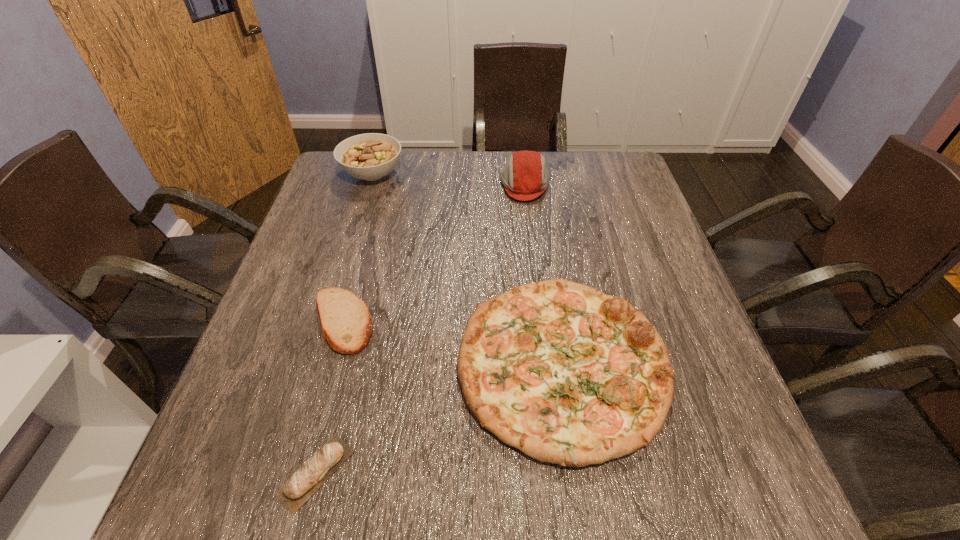
At what (x,y) coordinates should I click in order to perform the action: click on free space located 0.120m on the back of the farther pita bread. Please return your answer as a coordinate pair (x, y). The width and height of the screenshot is (960, 540). Looking at the image, I should click on (361, 255).

Where is `vacant space situated 0.260m on the back of the nearer pita bread`? This screenshot has width=960, height=540. vacant space situated 0.260m on the back of the nearer pita bread is located at coordinates (355, 318).

Locate an element on the screen. cap that is at the far edge is located at coordinates (525, 177).

This screenshot has width=960, height=540. Find the location of `stew situated at the far edge`. stew situated at the far edge is located at coordinates (371, 156).

At what (x,y) coordinates should I click in order to perform the action: click on pizza present at the near edge. Please return your answer as a coordinate pair (x, y). Looking at the image, I should click on (568, 375).

Locate an element on the screen. Image resolution: width=960 pixels, height=540 pixels. pita bread present at the near edge is located at coordinates [315, 471].

This screenshot has width=960, height=540. In order to click on stew that is at the left edge in this screenshot , I will do `click(371, 156)`.

You are a GUI agent. You are given a task and a screenshot of the screen. Output one action in this format:
    pyautogui.click(x=<x>, y=<y>)
    Task: Click on the object that is positioned at the right edge
    
    Given the screenshot: What is the action you would take?
    pyautogui.click(x=568, y=375)

Find the location of a particular element. object present at the far left corner is located at coordinates (371, 156).

You are a GUI agent. You are given a task and a screenshot of the screen. Output one action in this format:
    pyautogui.click(x=<x>, y=<y>)
    Task: Click on the object that is positioned at the near left corner
    The width and height of the screenshot is (960, 540).
    Given the screenshot: What is the action you would take?
    pyautogui.click(x=315, y=471)